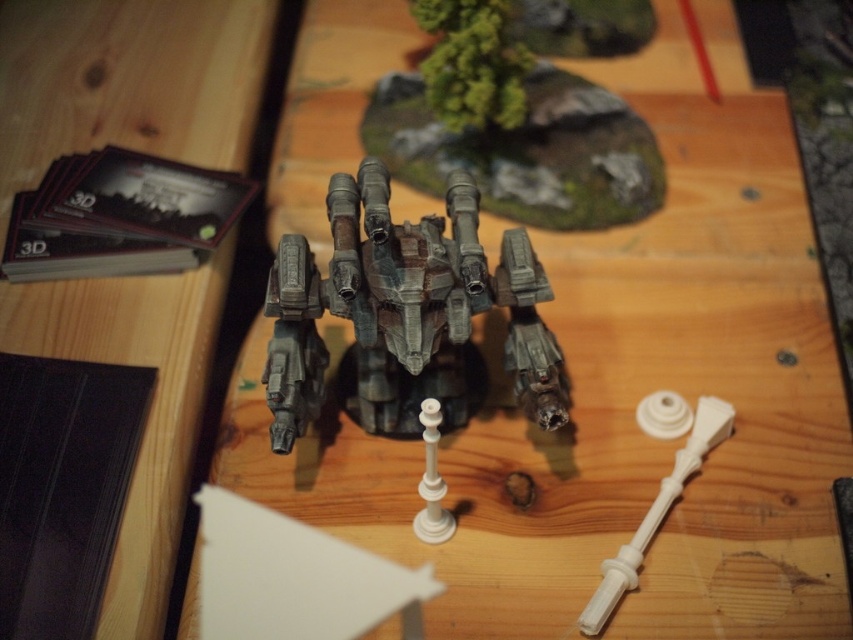
Question: Does rustic metal terrain at upper center come behind white plastic handle at center?

Choices:
 (A) no
 (B) yes

Answer: (B)

Question: Where is rusty metal mech at center located in relation to white plastic handle at center in the image?

Choices:
 (A) below
 (B) above

Answer: (B)

Question: Is rustic metal terrain at upper center closer to camera compared to white plastic handle at center?

Choices:
 (A) no
 (B) yes

Answer: (A)

Question: Among these points, which one is farthest from the camera?

Choices:
 (A) (277, 291)
 (B) (619, 572)
 (C) (577, 44)

Answer: (C)

Question: Which point is farther from the camera taking this photo?

Choices:
 (A) (672, 490)
 (B) (360, 241)

Answer: (A)

Question: Estimate the real-world distances between objects in this image. Which object is closer to the rusty metal mech at center?

Choices:
 (A) rustic metal terrain at upper center
 (B) white plastic handle at center

Answer: (B)